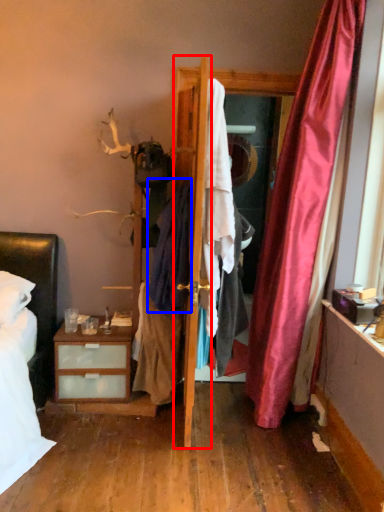
Question: Which point is further to the camera, door (highlighted by a red box) or clothing (highlighted by a blue box)?

Choices:
 (A) door
 (B) clothing

Answer: (B)